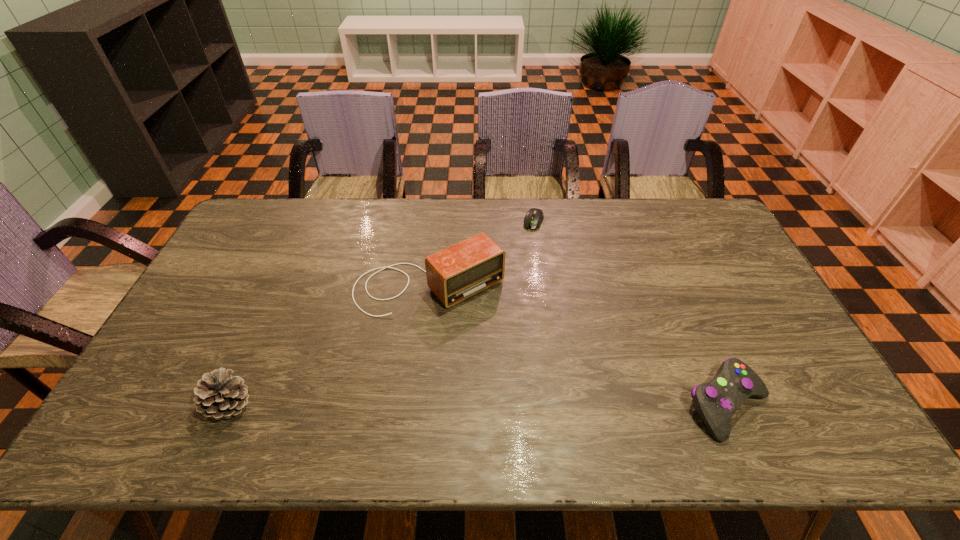
You are a GUI agent. You are given a task and a screenshot of the screen. Output one action in this format:
    pyautogui.click(x=<x>, y=<y>)
    Task: Click on the vacant space at the far edge
    
    Given the screenshot: What is the action you would take?
    pyautogui.click(x=573, y=211)

Identify the location of free space at the near edge. (404, 379).

At what (x,y) coordinates should I click in order to perform the action: click on blank area at the left edge. Please return your answer as a coordinate pair (x, y). The width and height of the screenshot is (960, 540). Looking at the image, I should click on (208, 320).

I want to click on free space at the right edge of the desktop, so click(x=746, y=303).

Where is `vacant region at the far left corner`? vacant region at the far left corner is located at coordinates (241, 227).

This screenshot has width=960, height=540. I want to click on vacant space at the near right corner of the desktop, so [x=808, y=405].

The height and width of the screenshot is (540, 960). Identify the location of vacant area that lies between the second object from left to right and the pinecone. (329, 347).

The width and height of the screenshot is (960, 540). I want to click on empty space that is in between the third nearest object and the control, so click(578, 346).

At what (x,y) coordinates should I click in order to perform the action: click on vacant area that lies between the leftmost object and the radio receiver. Please return your answer as a coordinate pair (x, y). Looking at the image, I should click on point(329,347).

Find the location of a particular element. This screenshot has width=960, height=540. unoccupied area between the shortest object and the leftmost object is located at coordinates (382, 313).